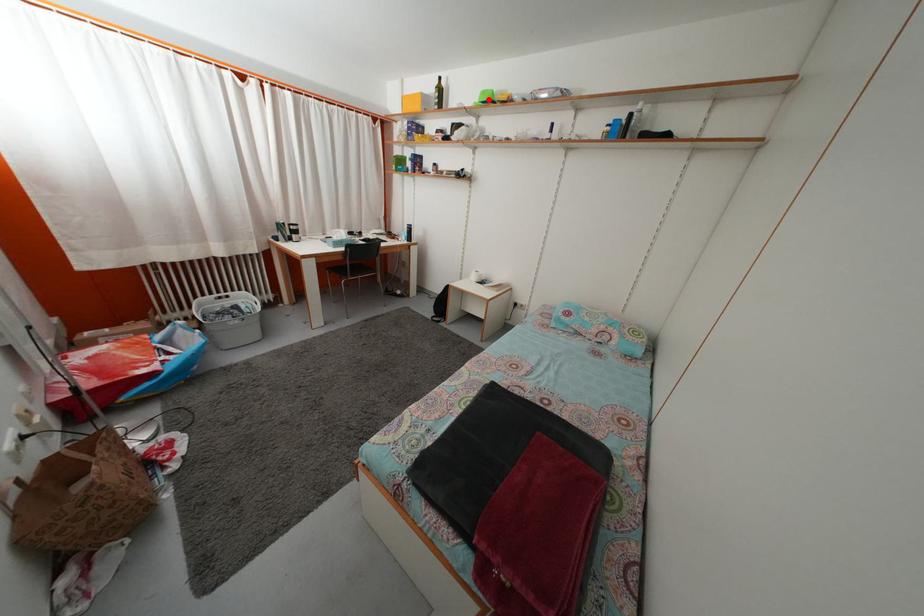
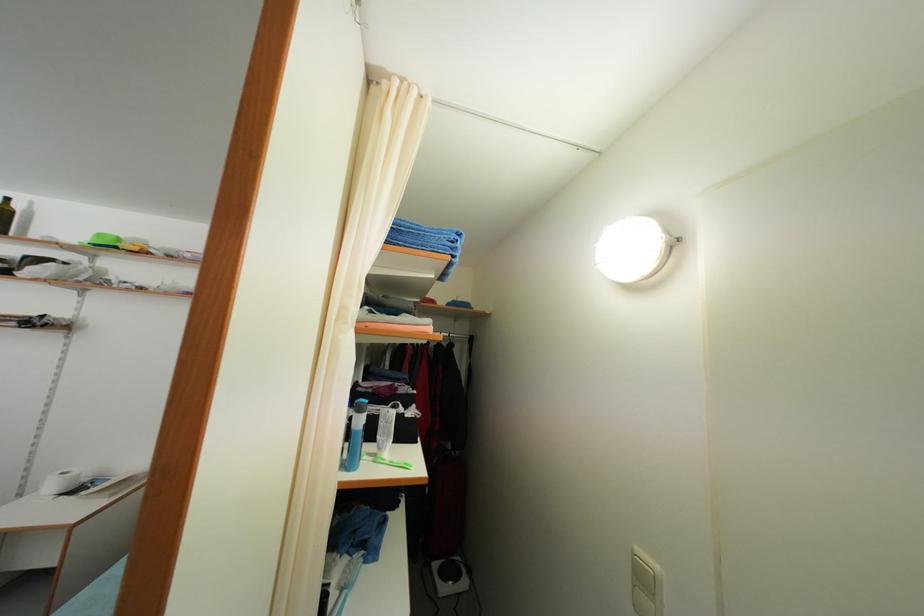
Where in the second image is the point corresponding to the highlighted location from the first image?

(104, 243)